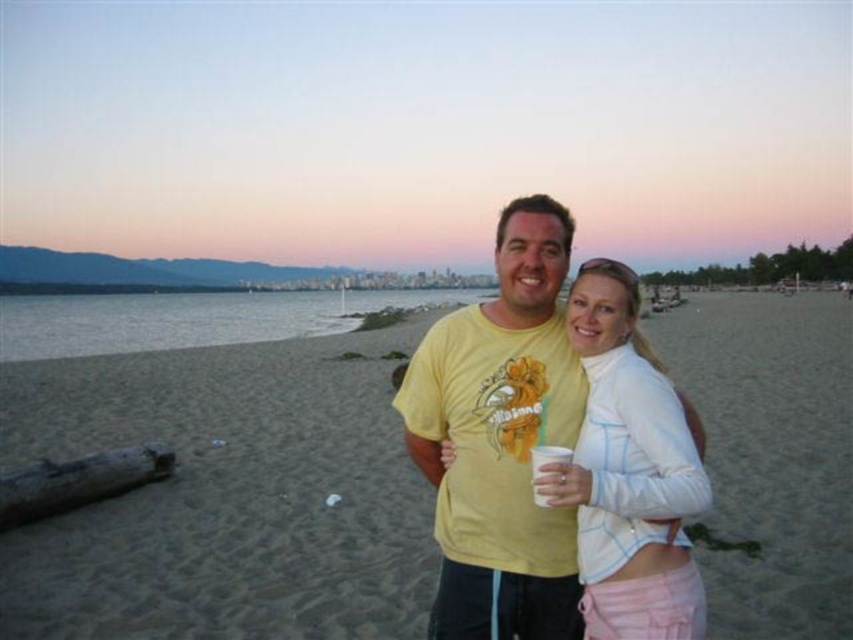
You are a photographer trying to capture a wide shot of the sandy beach at center and the white paper cup at center. Since you want to include both objects in the frame, which one should you focus on to ensure both are visible?

You should focus on the sandy beach at center because it is larger in size than the white paper cup at center, making it easier to frame both objects in the shot.

You are a photographer trying to capture a photo of the sandy beach at center and the white matte jacket at center. Based on their positions, which one is closer to the camera?

The sandy beach at center is closer to the camera because the white matte jacket at center is positioned behind it.